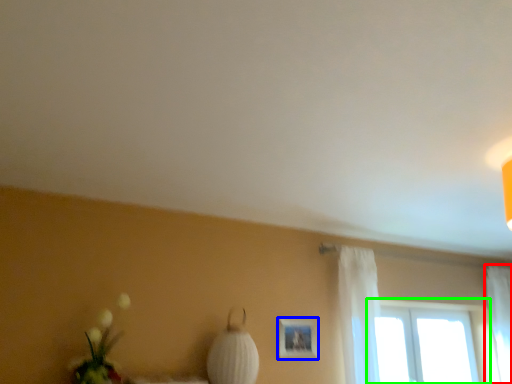
Question: Considering the real-world distances, which object is farthest from curtain (highlighted by a red box)? picture frame (highlighted by a blue box) or window (highlighted by a green box)?

Choices:
 (A) picture frame
 (B) window

Answer: (A)